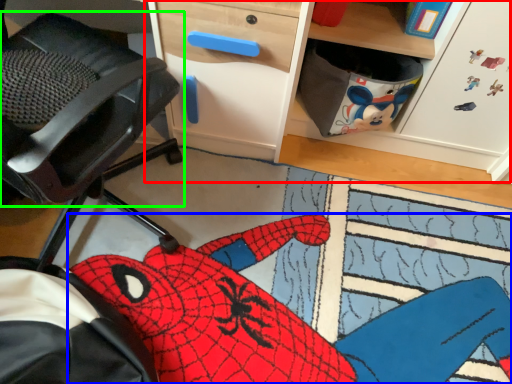
Question: Which is nearer to the computer desk (highlighted by a red box)? animal (highlighted by a blue box) or chair (highlighted by a green box).

Choices:
 (A) animal
 (B) chair

Answer: (B)